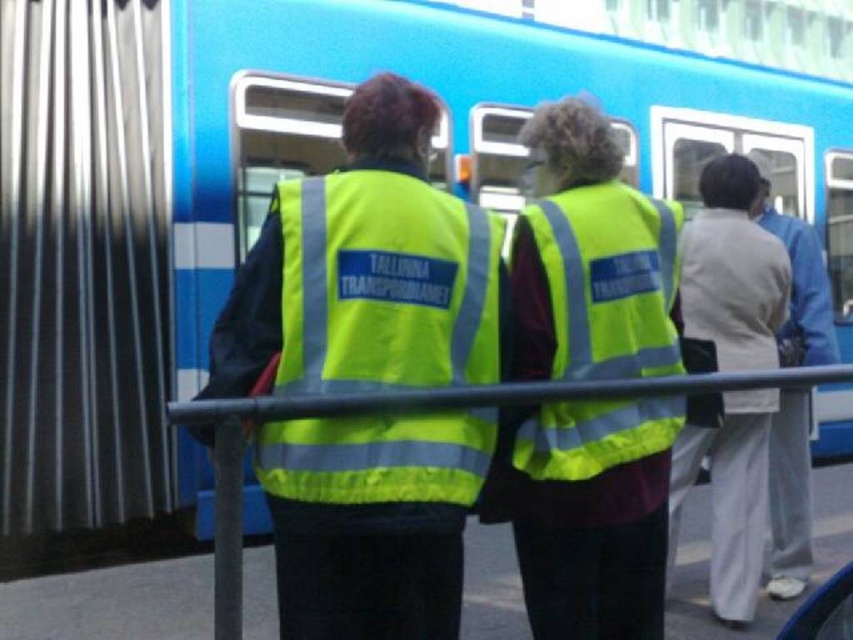
You are a passenger on the platform and want to locate the staff member wearing the neon yellow reflective vest at center and the person wearing white cotton pants at right. Which staff member is closer to you?

The neon yellow reflective vest at center is in front of the white cotton pants at right, so the staff member wearing the neon yellow reflective vest at center is closer to you.

You are a passenger on the platform and want to cross to the other side. You see the white cotton pants at right and the reflective plastic rail at center. Which object is narrower?

The white cotton pants at right has a lesser width compared to the reflective plastic rail at center, so the white cotton pants at right is narrower.